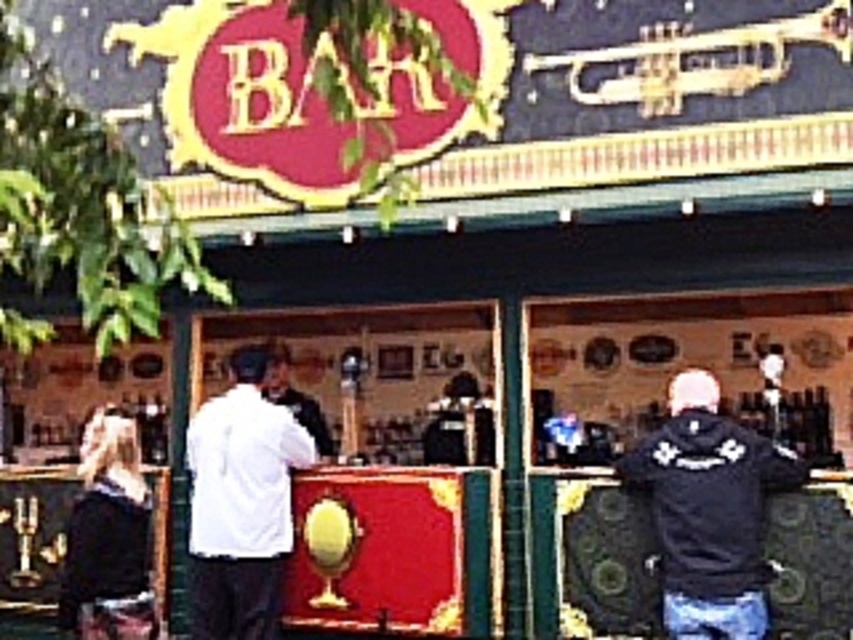
Consider the image. How much distance is there between black matte jacket at right and white matte shirt at center?

A distance of 7.84 meters exists between black matte jacket at right and white matte shirt at center.

Is point (694, 499) behind point (215, 500)?

No.

This screenshot has height=640, width=853. What are the coordinates of `black matte jacket at right` in the screenshot? It's located at (709, 509).

Can you confirm if white matte shirt at center is thinner than gold brass trumpet at upper right?

Correct, white matte shirt at center's width is less than gold brass trumpet at upper right's.

Is white matte shirt at center above gold brass trumpet at upper right?

Actually, white matte shirt at center is below gold brass trumpet at upper right.

I want to click on white matte shirt at center, so click(241, 502).

Who is more forward, (651, 456) or (596, 86)?

Point (651, 456)

From the picture: Measure the distance between point (630,456) and camera.

They are 25.49 meters apart.

Identify the location of black matte jacket at right. This screenshot has height=640, width=853. (709, 509).